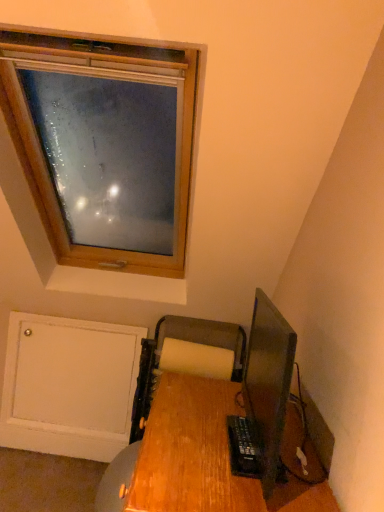
I want to click on free spot in front of matte black monitor at lower right, so click(x=228, y=485).